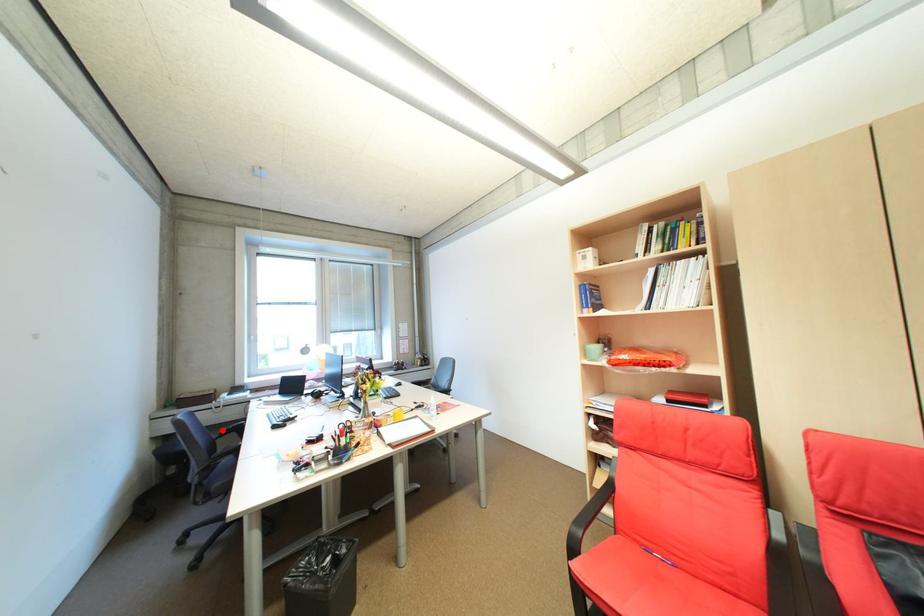
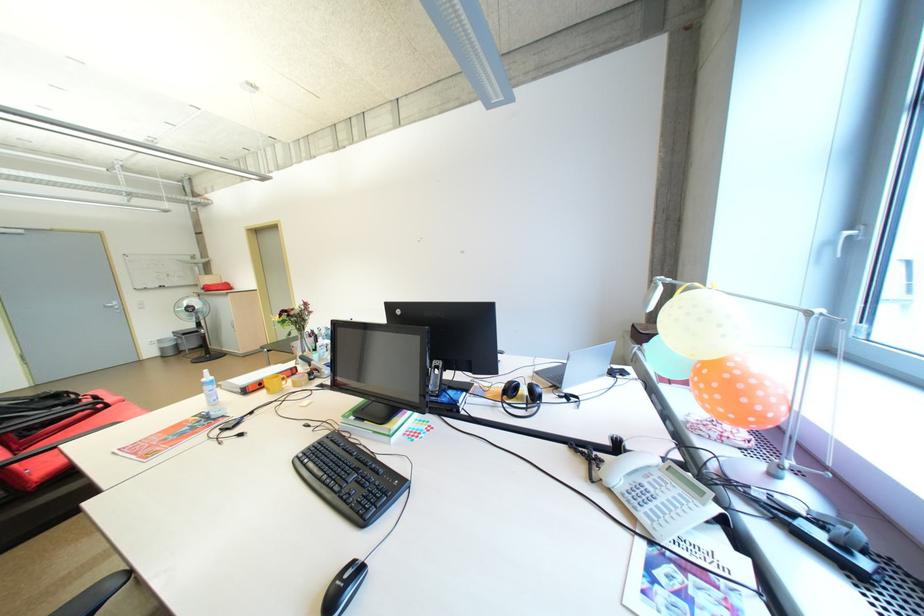
Question: I am providing you with two images of the same scene from different viewpoints. A red point is marked on the first image. At the location where the point appears in image 1, is it still visible in image 2?

Choices:
 (A) Yes
 (B) No

Answer: (B)